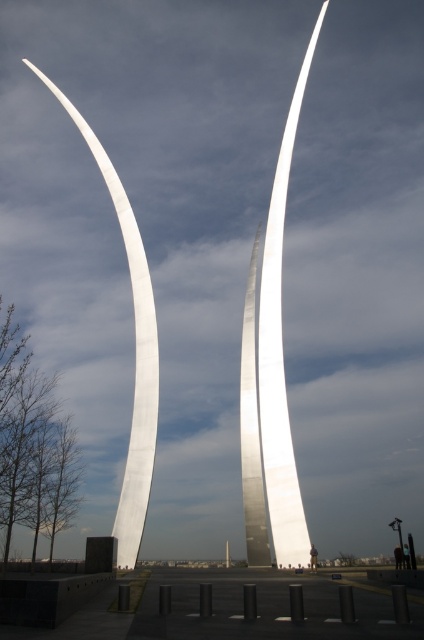
Question: Which point is farther to the camera?

Choices:
 (A) (130, 480)
 (B) (270, 497)

Answer: (A)

Question: Does polished metal sculpture at center have a lesser width compared to polished silver sculpture at left?

Choices:
 (A) yes
 (B) no

Answer: (A)

Question: Can you confirm if polished metal sculpture at center is thinner than polished silver sculpture at left?

Choices:
 (A) no
 (B) yes

Answer: (B)

Question: In this image, where is polished metal sculpture at center located relative to polished silver sculpture at left?

Choices:
 (A) above
 (B) below

Answer: (A)

Question: Which object is farther from the camera taking this photo?

Choices:
 (A) polished silver sculpture at left
 (B) polished metal sculpture at center

Answer: (A)

Question: Which point is closer to the camera?

Choices:
 (A) polished metal sculpture at center
 (B) polished silver sculpture at left

Answer: (A)